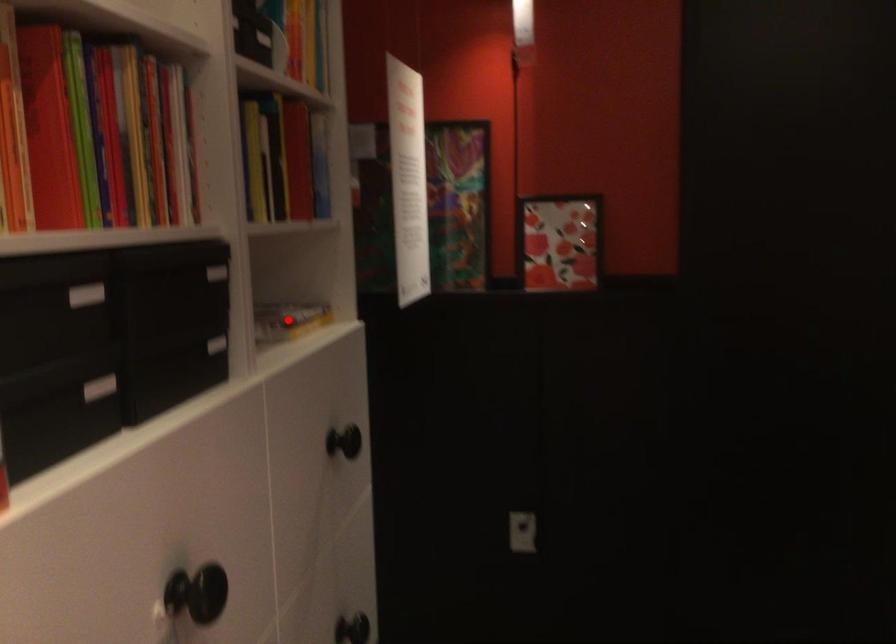
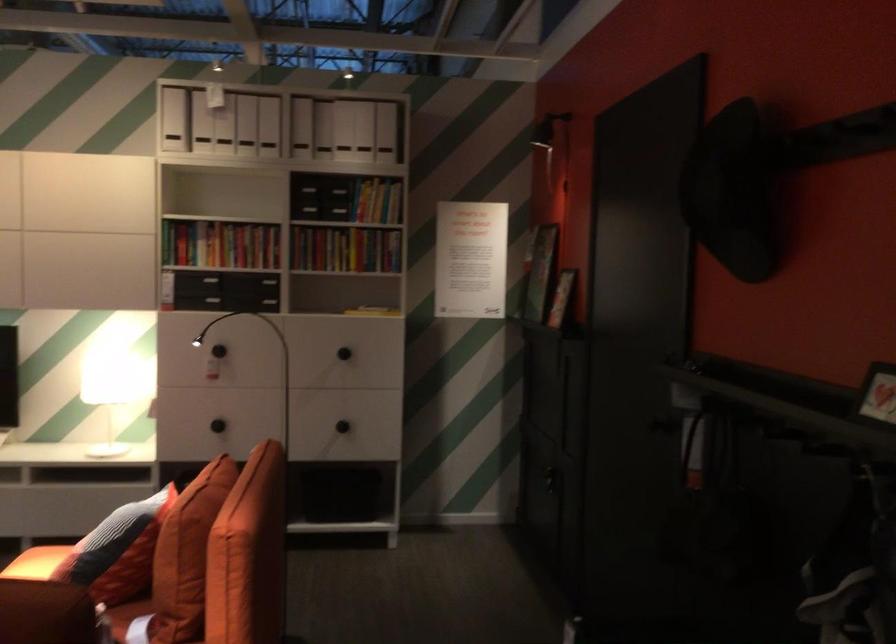
Question: I am providing you with two images of the same scene from different viewpoints. A red point is marked on the first image. Can you still see the location of the red point in image 2?

Choices:
 (A) Yes
 (B) No

Answer: (B)